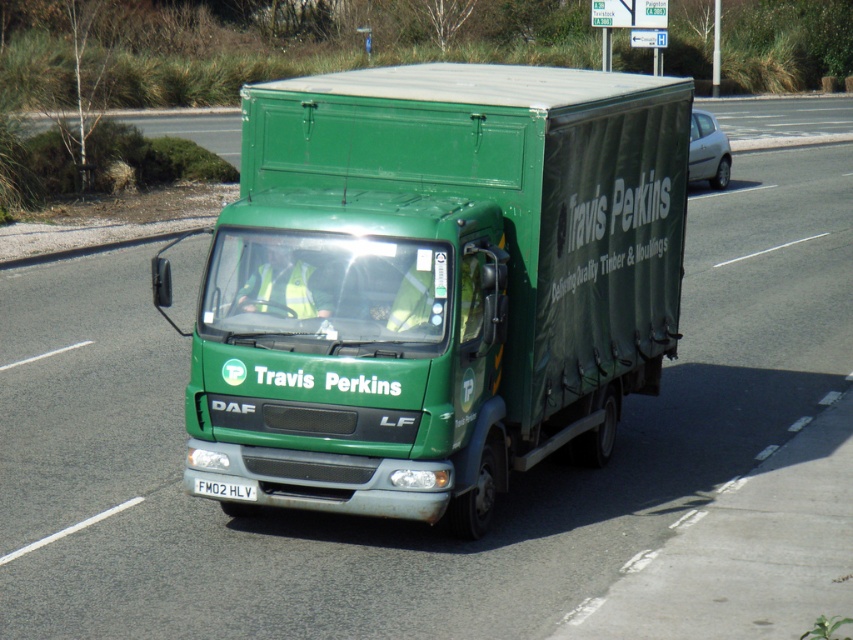
You are a passenger in the green delivery truck from Travis Perkins. You notice two points marked on the road ahead. The first point is at coordinates point [657,112] and the second is at point [229,497]. Which point is closer to the truck?

Point [229,497] is closer to the truck because it is nearer to the camera compared to point [657,112], which is further away.

You are a traffic officer checking license plates from a helicopter above the road. You see the green matte truck at center and the white plastic license plate at center. Which one is higher from your viewpoint?

The green matte truck at center is above the white plastic license plate at center, so from the helicopter viewpoint, the green matte truck at center is higher.

You are a pedestrian standing on the sidewalk next to the road. You see the green matte truck at center and the white plastic license plate at center. How far apart are these two objects from each other?

The green matte truck at center is 6.49 feet away from the white plastic license plate at center.